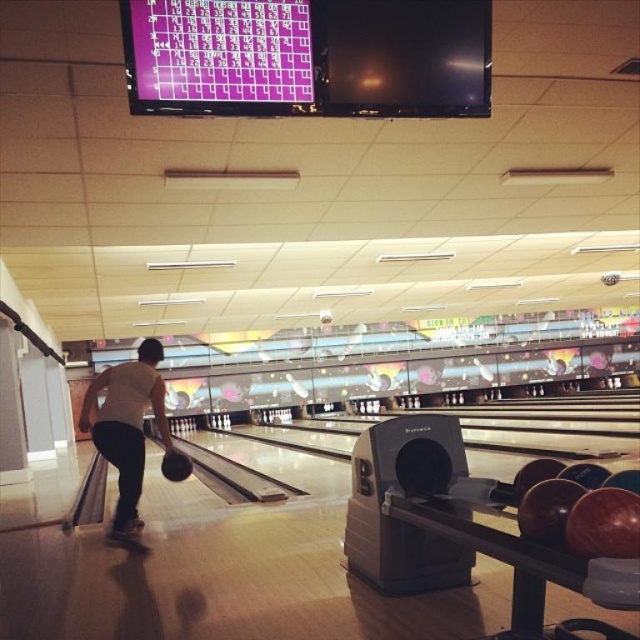
You are standing at the entrance of the bowling alley and want to see both the purple glossy scoreboard at upper center and the white matte bowling ball at center. Which object will appear larger in your view?

The purple glossy scoreboard at upper center will appear larger because it is closer to the viewer than the white matte bowling ball at center.

You are a bowler standing at the approach area of the lane. You want to check the score before releasing your ball. Which object should you look at first, the purple glossy scoreboard at upper center or the white matte bowling ball at center?

You should look at the purple glossy scoreboard at upper center first because it is located above the white matte bowling ball at center, making it more visible from your position at the approach area.

You are standing at the point marked by the coordinates point (346, 49) and want to walk towards the point marked by point (132, 476). Given the layout of the bowling alley described, will you pass in front of or behind the person throwing the ball?

Since point (346, 49) is in front of point (132, 476), you will be walking towards a point that is behind your current position. Therefore, you will pass behind the person throwing the ball.